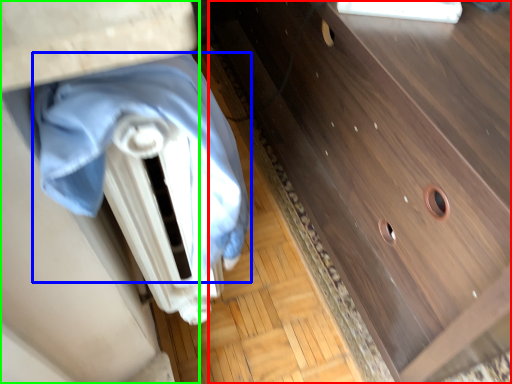
Question: Estimate the real-world distances between objects in this image. Which object is farther from chest of drawers (highlighted by a red box), blanket (highlighted by a blue box) or vanity (highlighted by a green box)?

Choices:
 (A) blanket
 (B) vanity

Answer: (B)